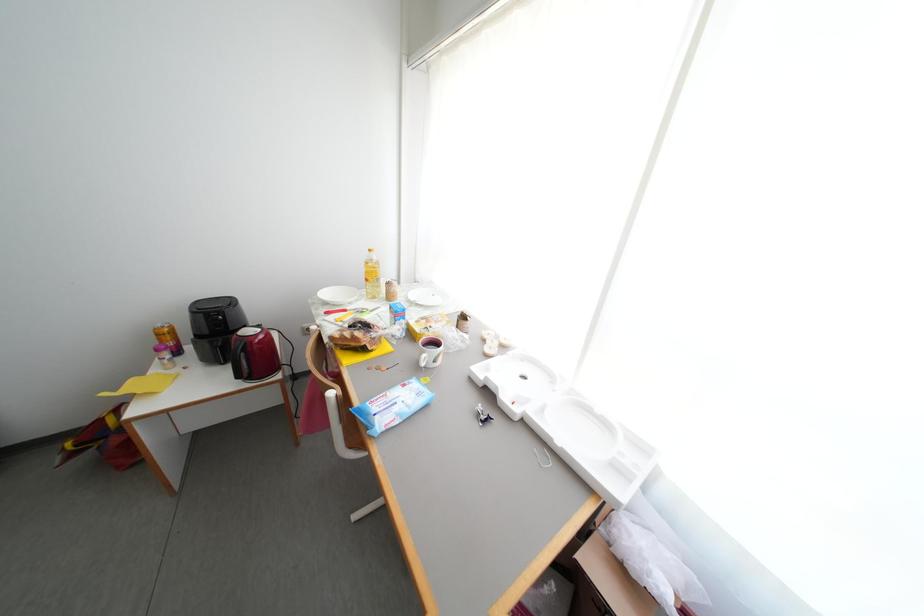
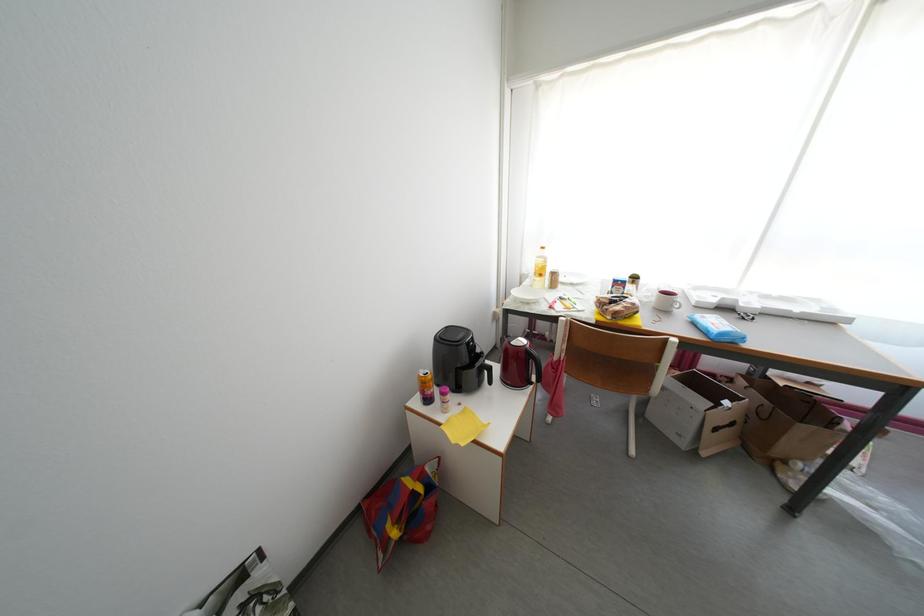
Question: In a continuous first-person perspective shot, in which direction is the camera moving?

Choices:
 (A) Left
 (B) Right
 (C) Forward
 (D) Backward

Answer: (A)